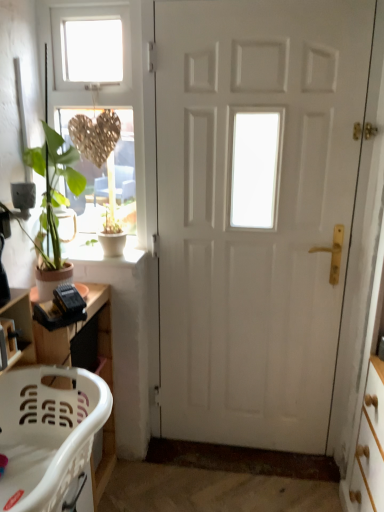
Question: Considering the positions of point (147, 5) and point (66, 258), is point (147, 5) closer or farther from the camera than point (66, 258)?

Choices:
 (A) farther
 (B) closer

Answer: (B)

Question: In the image, is matte gold heart at upper left on the left side or the right side of white concrete window sill at lower left?

Choices:
 (A) left
 (B) right

Answer: (B)

Question: Considering the real-world distances, which object is closest to the white matte pot at window?

Choices:
 (A) white plastic laundry basket at lower left
 (B) white plastic laundry basket at lower left
 (C) wooden shelf at lower left
 (D) white concrete window sill at lower left
 (E) white matte door at center

Answer: (D)

Question: Which is nearer to the wooden shelf at lower left?

Choices:
 (A) white concrete window sill at lower left
 (B) matte gold heart at upper left
 (C) white matte door at center
 (D) white plastic laundry basket at lower left
 (E) white matte pot at window

Answer: (D)